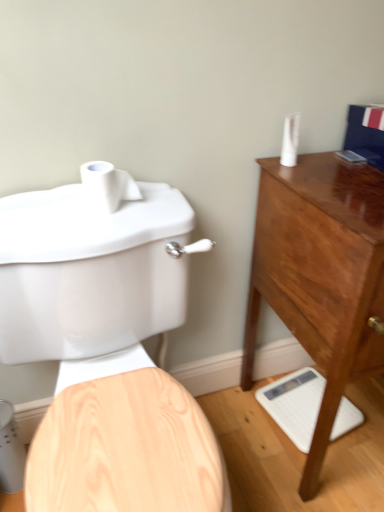
Question: Considering the relative sizes of white matte toilet paper at upper left and white glossy scale at lower right in the image provided, is white matte toilet paper at upper left shorter than white glossy scale at lower right?

Choices:
 (A) yes
 (B) no

Answer: (B)

Question: Is white matte toilet paper at upper left looking in the opposite direction of white glossy scale at lower right?

Choices:
 (A) yes
 (B) no

Answer: (B)

Question: Is white matte toilet paper at upper left bigger than white glossy scale at lower right?

Choices:
 (A) no
 (B) yes

Answer: (A)

Question: From the image's perspective, is white matte toilet paper at upper left above white glossy scale at lower right?

Choices:
 (A) yes
 (B) no

Answer: (A)

Question: From a real-world perspective, is white matte toilet paper at upper left located higher than white glossy scale at lower right?

Choices:
 (A) no
 (B) yes

Answer: (B)

Question: From the image's perspective, is matte white toilet at left located above or below mahogany wood chest of drawers at right?

Choices:
 (A) above
 (B) below

Answer: (B)

Question: Does point (64, 486) appear closer or farther from the camera than point (377, 251)?

Choices:
 (A) closer
 (B) farther

Answer: (A)

Question: Looking at their shapes, would you say matte white toilet at left is wider or thinner than mahogany wood chest of drawers at right?

Choices:
 (A) thin
 (B) wide

Answer: (B)

Question: Based on their sizes in the image, would you say matte white toilet at left is bigger or smaller than mahogany wood chest of drawers at right?

Choices:
 (A) big
 (B) small

Answer: (A)

Question: In terms of width, does matte white toilet at left look wider or thinner when compared to white matte toilet paper at upper left?

Choices:
 (A) wide
 (B) thin

Answer: (A)

Question: From the image's perspective, relative to white matte toilet paper at upper left, is matte white toilet at left above or below?

Choices:
 (A) above
 (B) below

Answer: (B)

Question: Looking at the image, does matte white toilet at left seem bigger or smaller compared to white matte toilet paper at upper left?

Choices:
 (A) big
 (B) small

Answer: (A)

Question: Considering the positions of matte white toilet at left and white matte toilet paper at upper left in the image, is matte white toilet at left taller or shorter than white matte toilet paper at upper left?

Choices:
 (A) tall
 (B) short

Answer: (A)

Question: Which is correct: white plastic toothpaste tube at upper right is inside mahogany wood chest of drawers at right, or outside of it?

Choices:
 (A) outside
 (B) inside

Answer: (A)

Question: Based on their positions, is white plastic toothpaste tube at upper right located to the left or right of mahogany wood chest of drawers at right?

Choices:
 (A) left
 (B) right

Answer: (A)